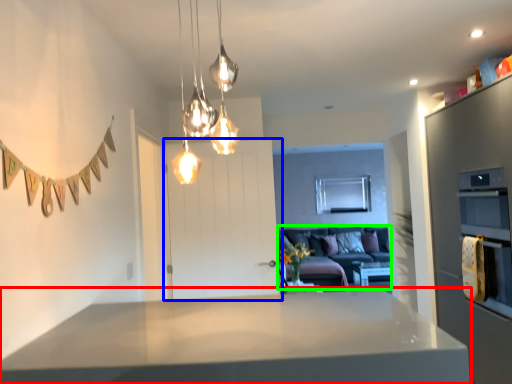
Question: Based on their relative distances, which object is nearer to countertop (highlighted by a red box)? Choose from door (highlighted by a blue box) and couch (highlighted by a green box).

Choices:
 (A) door
 (B) couch

Answer: (A)